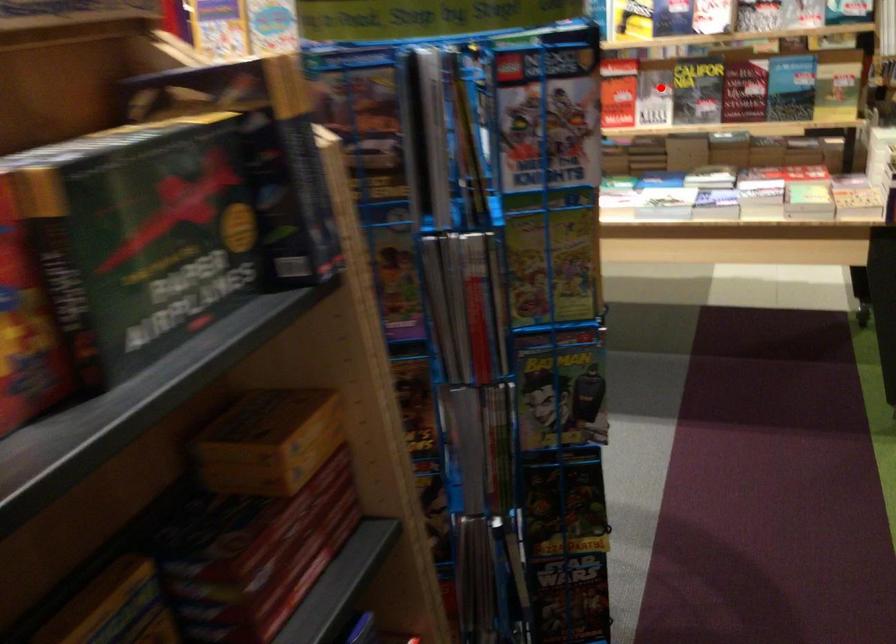
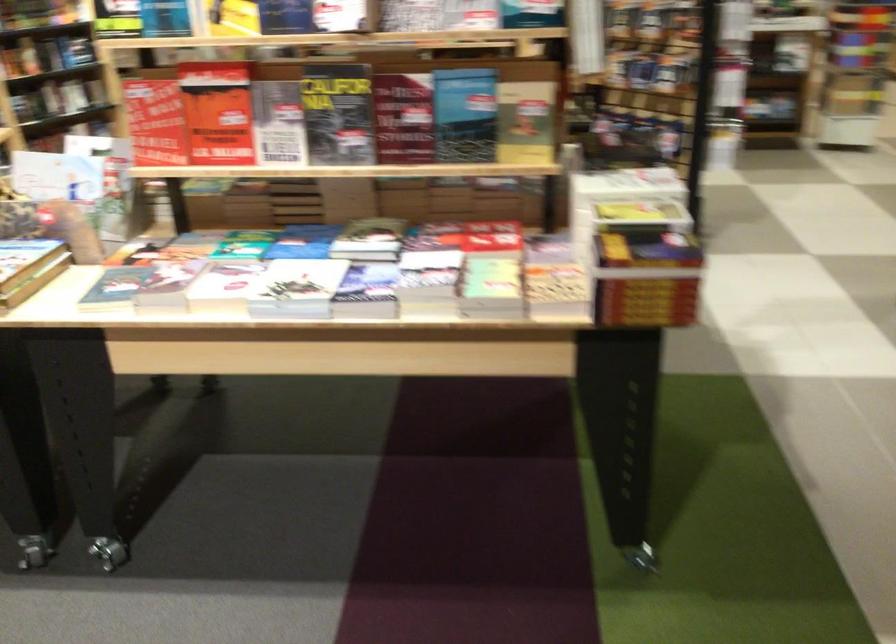
Question: I am providing you with two images of the same scene from different viewpoints. In image1, a red point is highlighted. Considering the same 3D point in image2, which of the following is correct?

Choices:
 (A) It is closer
 (B) It is farther

Answer: (A)